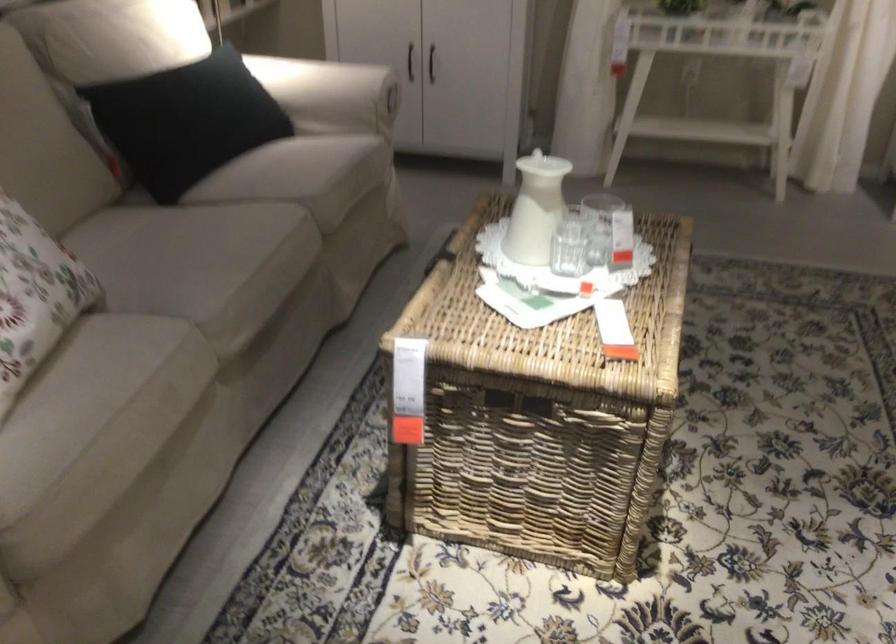
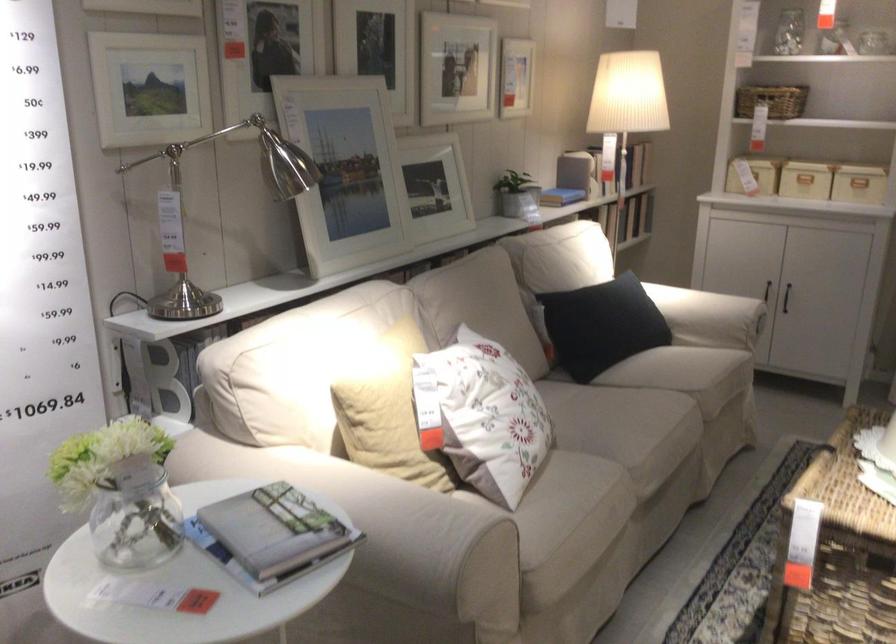
Find the pixel in the second image that matches (x=420, y=79) in the first image.

(786, 297)